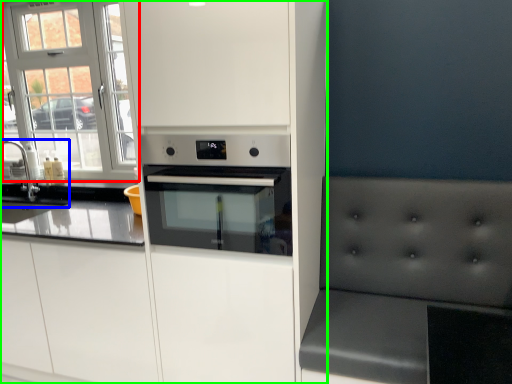
Question: Which object is the farthest from window (highlighted by a red box)? Choose among these: sink (highlighted by a blue box) or cabinetry (highlighted by a green box).

Choices:
 (A) sink
 (B) cabinetry

Answer: (B)